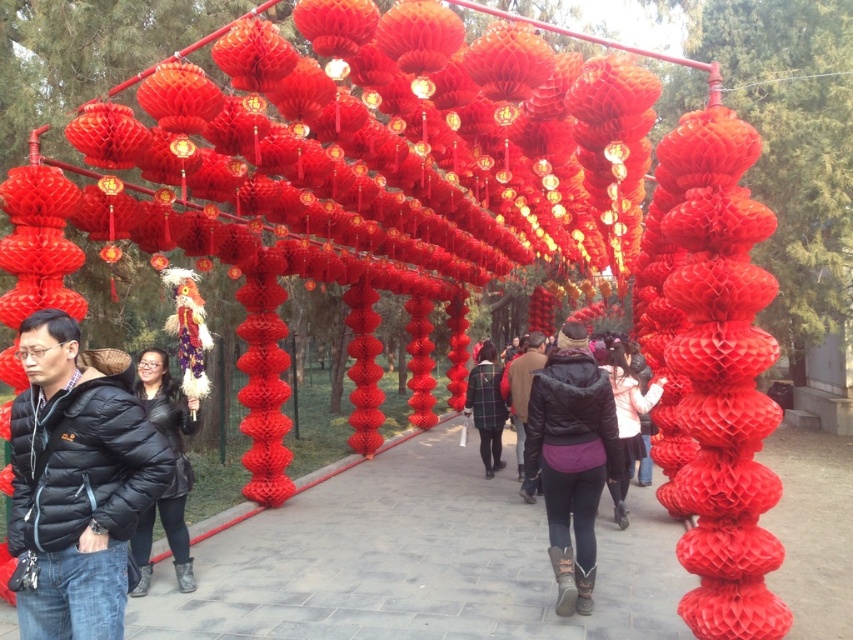
Is matte black jacket at center to the right of plaid shirt at center from the viewer's perspective?

Correct, you'll find matte black jacket at center to the right of plaid shirt at center.

Between point (659, 380) and point (494, 380), which one is positioned in front?

Point (659, 380) is more forward.

The height and width of the screenshot is (640, 853). I want to click on matte black jacket at center, so click(x=627, y=420).

Can you confirm if purple fleece jacket at center is positioned above plaid shirt at center?

Yes.

Is purple fleece jacket at center wider than plaid shirt at center?

Correct, the width of purple fleece jacket at center exceeds that of plaid shirt at center.

This screenshot has height=640, width=853. I want to click on purple fleece jacket at center, so click(x=572, y=460).

Consider the image. Between matte red honeycomb at center and black puffer jacket at center, which one is positioned higher?

black puffer jacket at center is above.

From the picture: Who is more distant from viewer, (677,525) or (138,566)?

Positioned behind is point (677,525).

Between point (466, 545) and point (180, 572), which one is positioned in front?

Point (180, 572) is more forward.

Locate an element on the screen. matte red honeycomb at center is located at coordinates (416, 561).